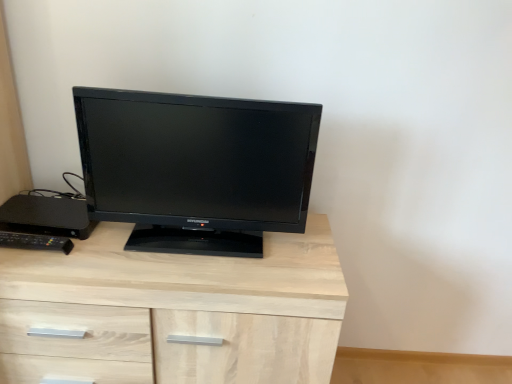
I want to click on vacant area located to the right-hand side of black plastic remote control at left, which is counted as the 2th desktop, starting from the back, so tap(94, 249).